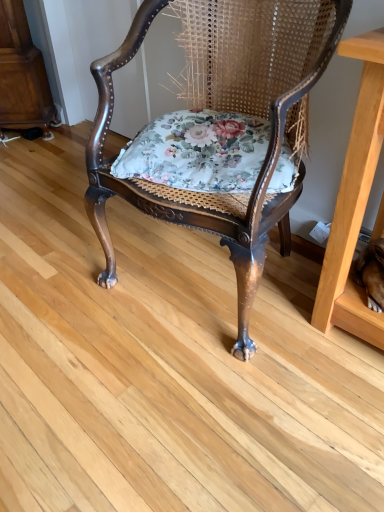
The height and width of the screenshot is (512, 384). I want to click on vacant space that is to the left of polished wood chair at center, so click(x=67, y=277).